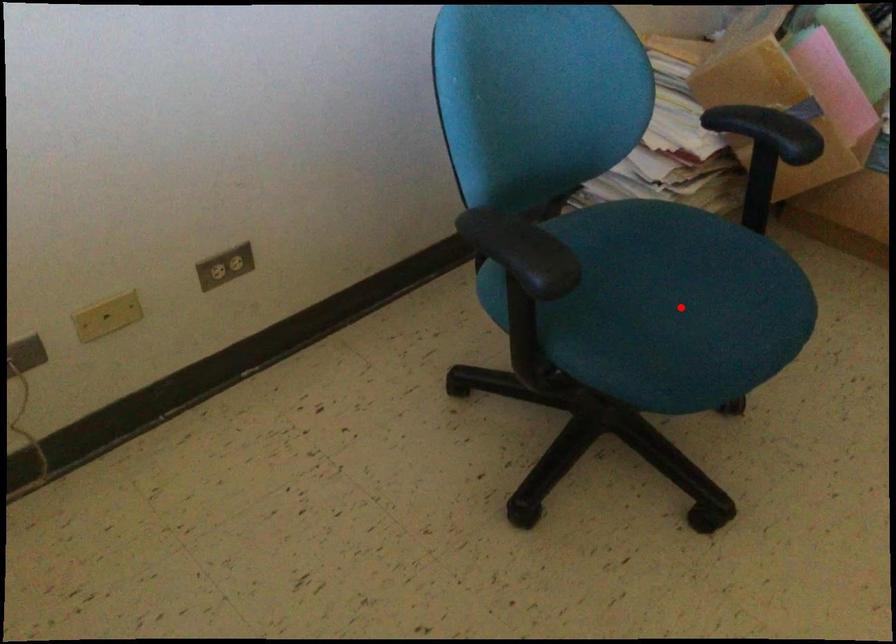
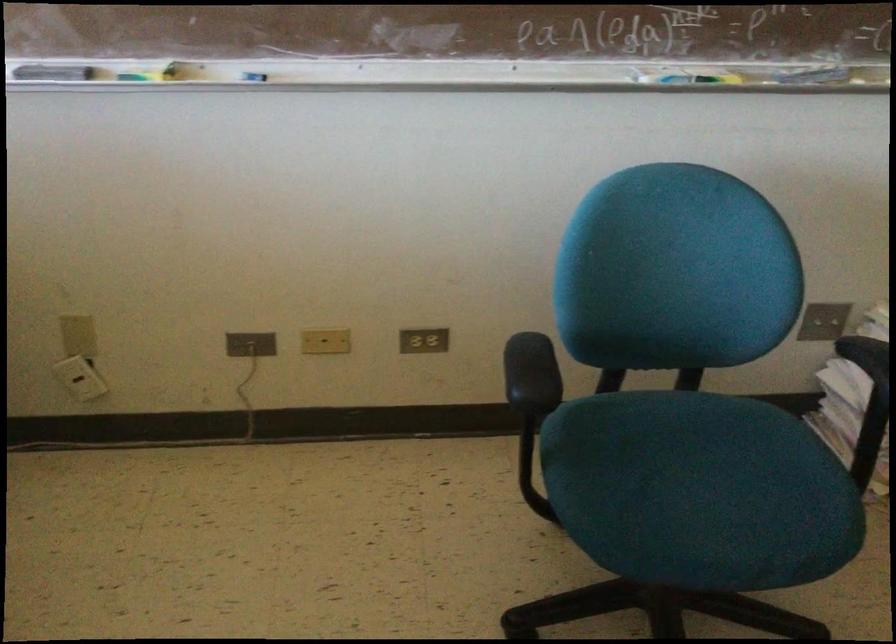
Where in the second image is the point corresponding to the highlighted location from the first image?

(700, 491)